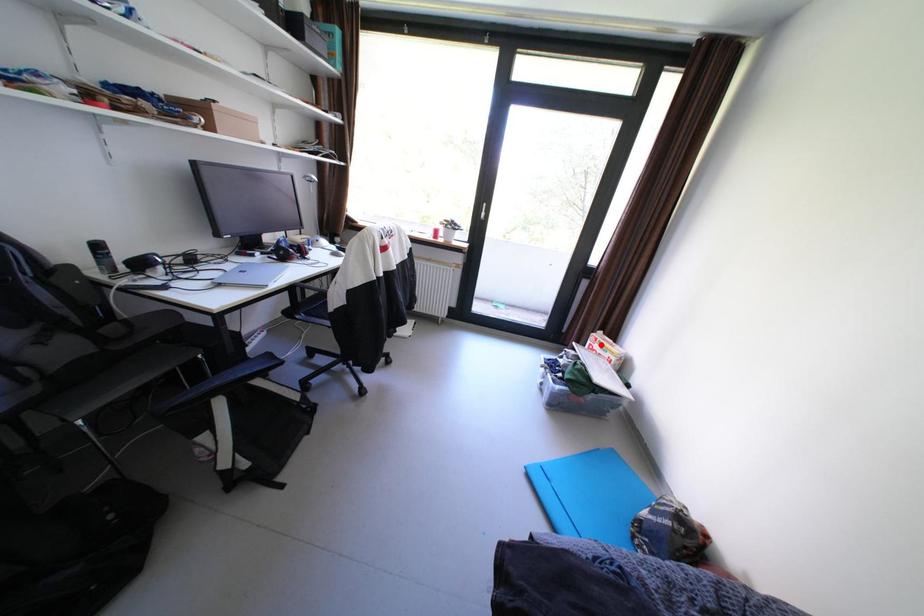
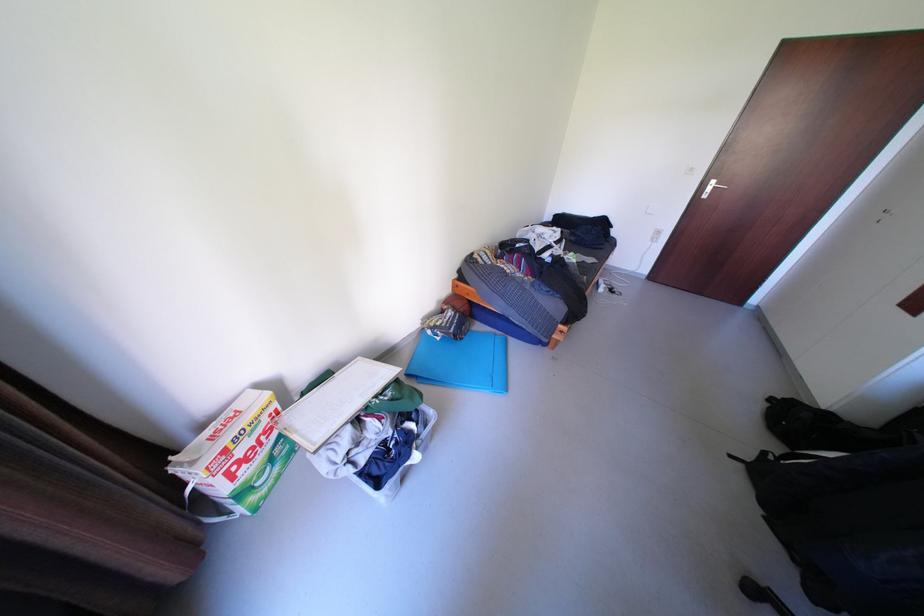
Question: I am providing you with two images of the same scene from different viewpoints. A red point is shown in image1. For the corresponding object point in image2, is it positioned nearer or farther from the camera?

Choices:
 (A) Nearer
 (B) Farther

Answer: (A)